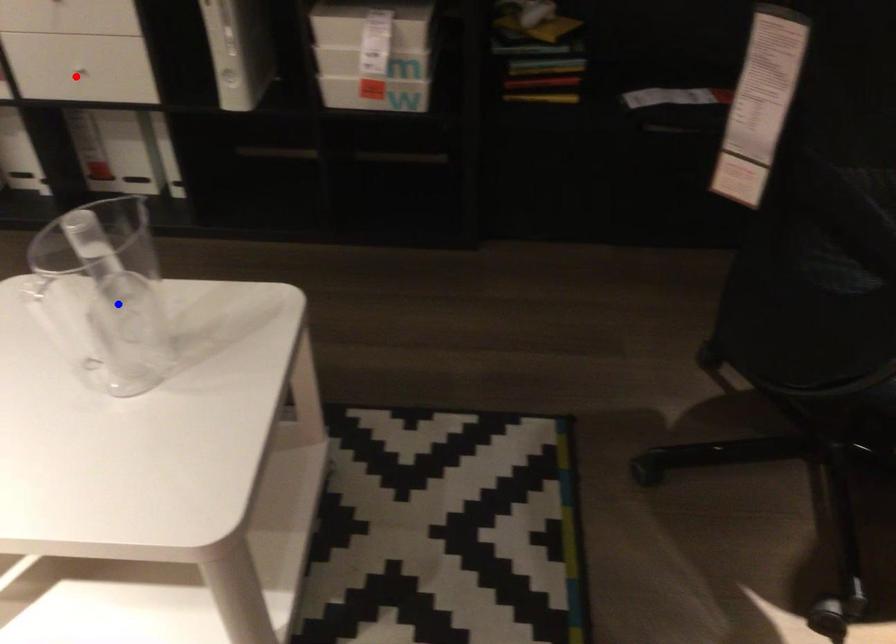
Question: Two points are marked on the image. Which point is closer to the camera?

Choices:
 (A) Blue point is closer.
 (B) Red point is closer.

Answer: (A)